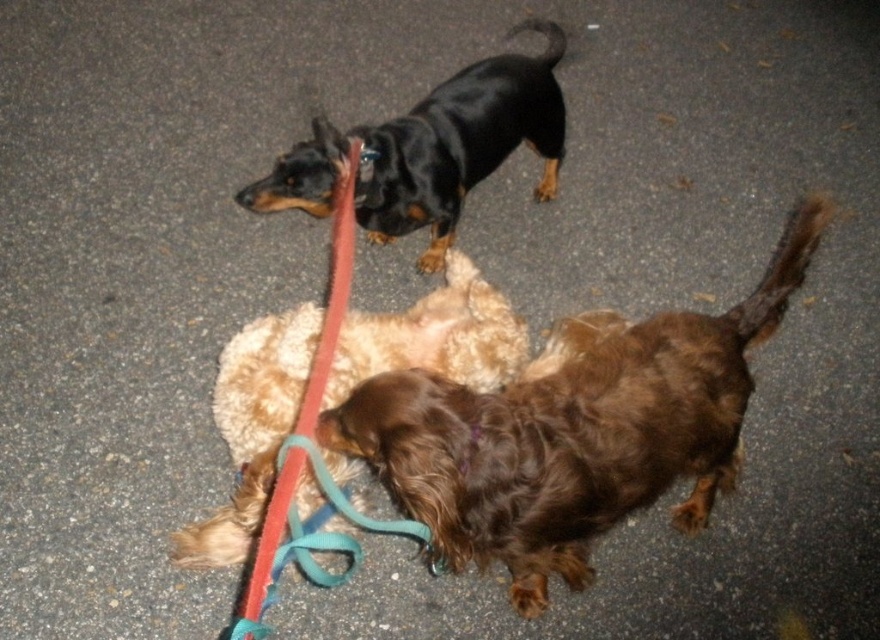
Question: Among these objects, which one is farthest from the camera?

Choices:
 (A) brown shaggy dog at center
 (B) fuzzy brown dog at center
 (C) black glossy dog at upper center

Answer: (C)

Question: Estimate the real-world distances between objects in this image. Which object is farther from the black glossy dog at upper center?

Choices:
 (A) brown shaggy dog at center
 (B) fuzzy brown dog at center

Answer: (A)

Question: Can you confirm if brown shaggy dog at center is smaller than fuzzy brown dog at center?

Choices:
 (A) no
 (B) yes

Answer: (A)

Question: Among these points, which one is farthest from the camera?

Choices:
 (A) (369, 202)
 (B) (306, 374)

Answer: (A)

Question: Is brown shaggy dog at center to the right of black glossy dog at upper center from the viewer's perspective?

Choices:
 (A) yes
 (B) no

Answer: (A)

Question: Is brown shaggy dog at center wider than black glossy dog at upper center?

Choices:
 (A) yes
 (B) no

Answer: (A)